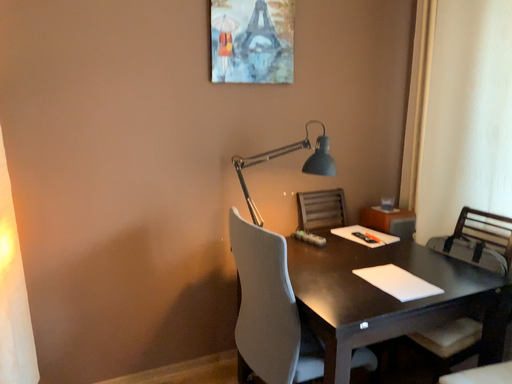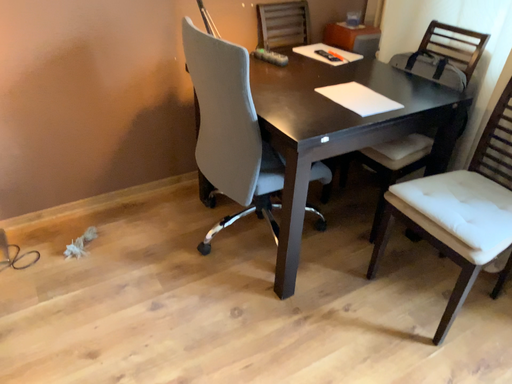
Question: How did the camera likely rotate when shooting the video?

Choices:
 (A) rotated upward
 (B) rotated downward

Answer: (B)